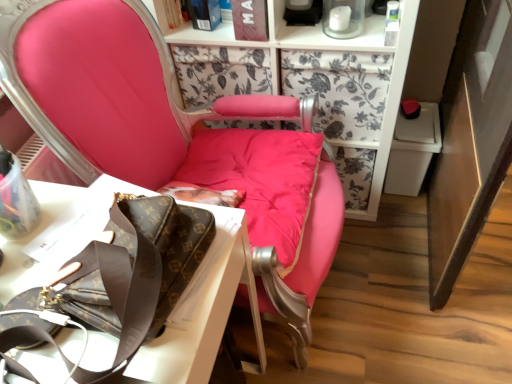
Question: Is white paper at upper left positioned far away from matte pink cushion at center?

Choices:
 (A) no
 (B) yes

Answer: (A)

Question: Considering the relative positions of white paper at upper left and matte pink cushion at center in the image provided, is white paper at upper left in front of matte pink cushion at center?

Choices:
 (A) yes
 (B) no

Answer: (B)

Question: From a real-world perspective, is white paper at upper left located higher than matte pink cushion at center?

Choices:
 (A) yes
 (B) no

Answer: (B)

Question: Can you confirm if white paper at upper left is positioned to the left of matte pink cushion at center?

Choices:
 (A) yes
 (B) no

Answer: (A)

Question: Are white paper at upper left and matte pink cushion at center making contact?

Choices:
 (A) yes
 (B) no

Answer: (B)

Question: Does white paper at upper left come behind matte pink cushion at center?

Choices:
 (A) yes
 (B) no

Answer: (A)

Question: Considering the relative positions of matte pink cushion at center and white paper at upper left in the image provided, is matte pink cushion at center to the right of white paper at upper left from the viewer's perspective?

Choices:
 (A) no
 (B) yes

Answer: (B)

Question: Can we say matte pink cushion at center lies outside white paper at upper left?

Choices:
 (A) no
 (B) yes

Answer: (B)

Question: Is matte pink cushion at center to the left of white paper at upper left from the viewer's perspective?

Choices:
 (A) no
 (B) yes

Answer: (A)

Question: Is white paper at upper left located within matte pink cushion at center?

Choices:
 (A) yes
 (B) no

Answer: (B)

Question: Is matte pink cushion at center far away from white paper at upper left?

Choices:
 (A) no
 (B) yes

Answer: (A)

Question: Does matte pink cushion at center turn towards white paper at upper left?

Choices:
 (A) no
 (B) yes

Answer: (A)

Question: In terms of height, does matte pink cushion at center look taller or shorter compared to white paper at upper left?

Choices:
 (A) tall
 (B) short

Answer: (A)